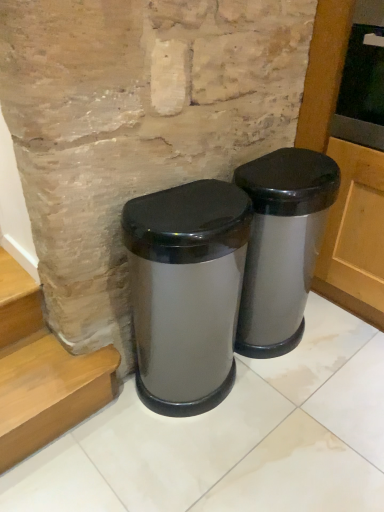
Find the location of a particular element. satin silver trash can at center, the 1th waste container positioned from the right is located at coordinates (282, 245).

What is the approximate height of satin silver trash can at center, the 1th waste container positioned from the right?

27.30 inches.

This screenshot has height=512, width=384. What do you see at coordinates (282, 245) in the screenshot?
I see `satin silver trash can at center, the 1th waste container positioned from the right` at bounding box center [282, 245].

The image size is (384, 512). In order to click on satin silver trash can at center, which is the 1th waste container in left-to-right order in this screenshot , I will do `click(186, 292)`.

Measure the distance between satin silver trash can at center, arranged as the second waste container when viewed from the right, and camera.

They are 38.10 inches apart.

What do you see at coordinates (186, 292) in the screenshot? I see `satin silver trash can at center, arranged as the second waste container when viewed from the right` at bounding box center [186, 292].

Locate an element on the screen. satin silver trash can at center, the 1th waste container positioned from the right is located at coordinates (282, 245).

Based on the photo, in the image, is satin silver trash can at center, which is the 1th waste container in left-to-right order, on the left side or the right side of satin silver trash can at center, the 1th waste container positioned from the right?

Clearly, satin silver trash can at center, which is the 1th waste container in left-to-right order, is on the left of satin silver trash can at center, the 1th waste container positioned from the right, in the image.

Based on the photo, is satin silver trash can at center, which is the 1th waste container in left-to-right order, further to camera compared to satin silver trash can at center, the 1th waste container positioned from the right?

No, satin silver trash can at center, which is the 1th waste container in left-to-right order, is closer to the viewer.

Considering the points (201, 395) and (280, 241), which point is behind, point (201, 395) or point (280, 241)?

Positioned behind is point (201, 395).

From the image's perspective, is satin silver trash can at center, which is the 1th waste container in left-to-right order, on top of satin silver trash can at center, which is the 2th waste container in left-to-right order?

Actually, satin silver trash can at center, which is the 1th waste container in left-to-right order, appears below satin silver trash can at center, which is the 2th waste container in left-to-right order, in the image.

From a real-world perspective, who is located higher, satin silver trash can at center, which is the 1th waste container in left-to-right order, or satin silver trash can at center, the 1th waste container positioned from the right?

satin silver trash can at center, which is the 1th waste container in left-to-right order.

Looking at this image, which of these two, satin silver trash can at center, arranged as the second waste container when viewed from the right, or satin silver trash can at center, the 1th waste container positioned from the right, is wider?

satin silver trash can at center, arranged as the second waste container when viewed from the right, is wider.

Who is shorter, satin silver trash can at center, arranged as the second waste container when viewed from the right, or satin silver trash can at center, which is the 2th waste container in left-to-right order?

satin silver trash can at center, which is the 2th waste container in left-to-right order.

Is satin silver trash can at center, which is the 1th waste container in left-to-right order, bigger or smaller than satin silver trash can at center, the 1th waste container positioned from the right?

Considering their sizes, satin silver trash can at center, which is the 1th waste container in left-to-right order, takes up less space than satin silver trash can at center, the 1th waste container positioned from the right.

Do you think satin silver trash can at center, arranged as the second waste container when viewed from the right, is within satin silver trash can at center, the 1th waste container positioned from the right, or outside of it?

The correct answer is: outside.

Is satin silver trash can at center, which is the 1th waste container in left-to-right order, directly adjacent to satin silver trash can at center, which is the 2th waste container in left-to-right order?

No, satin silver trash can at center, which is the 1th waste container in left-to-right order, is not beside satin silver trash can at center, which is the 2th waste container in left-to-right order.

Looking at this image, is satin silver trash can at center, arranged as the second waste container when viewed from the right, positioned with its back to satin silver trash can at center, the 1th waste container positioned from the right?

That's not correct — satin silver trash can at center, arranged as the second waste container when viewed from the right, is not looking away from satin silver trash can at center, the 1th waste container positioned from the right.

Measure the distance from satin silver trash can at center, which is the 1th waste container in left-to-right order, to satin silver trash can at center, which is the 2th waste container in left-to-right order.

satin silver trash can at center, which is the 1th waste container in left-to-right order, and satin silver trash can at center, which is the 2th waste container in left-to-right order, are 9.18 inches apart from each other.

In order to click on waste container that is behind the satin silver trash can at center, arranged as the second waste container when viewed from the right in this screenshot , I will do `click(282, 245)`.

Which object is positioned more to the right, satin silver trash can at center, the 1th waste container positioned from the right, or satin silver trash can at center, arranged as the second waste container when viewed from the right?

satin silver trash can at center, the 1th waste container positioned from the right.

Relative to satin silver trash can at center, arranged as the second waste container when viewed from the right, is satin silver trash can at center, which is the 2th waste container in left-to-right order, in front or behind?

In the image, satin silver trash can at center, which is the 2th waste container in left-to-right order, appears behind satin silver trash can at center, arranged as the second waste container when viewed from the right.

Considering the positions of point (253, 179) and point (151, 402), is point (253, 179) closer or farther from the camera than point (151, 402)?

Clearly, point (253, 179) is closer to the camera than point (151, 402).

Looking at this image, from the image's perspective, between satin silver trash can at center, the 1th waste container positioned from the right, and satin silver trash can at center, which is the 1th waste container in left-to-right order, which one is located above?

satin silver trash can at center, the 1th waste container positioned from the right.

From a real-world perspective, which is physically below, satin silver trash can at center, the 1th waste container positioned from the right, or satin silver trash can at center, arranged as the second waste container when viewed from the right?

satin silver trash can at center, the 1th waste container positioned from the right.

Which object is wider, satin silver trash can at center, the 1th waste container positioned from the right, or satin silver trash can at center, which is the 1th waste container in left-to-right order?

Wider between the two is satin silver trash can at center, which is the 1th waste container in left-to-right order.

Considering the sizes of objects satin silver trash can at center, which is the 2th waste container in left-to-right order, and satin silver trash can at center, arranged as the second waste container when viewed from the right, in the image provided, who is taller, satin silver trash can at center, which is the 2th waste container in left-to-right order, or satin silver trash can at center, arranged as the second waste container when viewed from the right,?

Standing taller between the two is satin silver trash can at center, arranged as the second waste container when viewed from the right.

Considering the relative sizes of satin silver trash can at center, the 1th waste container positioned from the right, and satin silver trash can at center, arranged as the second waste container when viewed from the right, in the image provided, is satin silver trash can at center, the 1th waste container positioned from the right, bigger than satin silver trash can at center, arranged as the second waste container when viewed from the right,?

Yes, satin silver trash can at center, the 1th waste container positioned from the right, is bigger than satin silver trash can at center, arranged as the second waste container when viewed from the right.

Does satin silver trash can at center, the 1th waste container positioned from the right, contain satin silver trash can at center, which is the 1th waste container in left-to-right order?

No.

Are satin silver trash can at center, the 1th waste container positioned from the right, and satin silver trash can at center, arranged as the second waste container when viewed from the right, located far from each other?

No, satin silver trash can at center, the 1th waste container positioned from the right, is in close proximity to satin silver trash can at center, arranged as the second waste container when viewed from the right.

Is satin silver trash can at center, the 1th waste container positioned from the right, positioned with its back to satin silver trash can at center, arranged as the second waste container when viewed from the right?

No, satin silver trash can at center, arranged as the second waste container when viewed from the right, is not at the back of satin silver trash can at center, the 1th waste container positioned from the right.

This screenshot has height=512, width=384. Find the location of `waste container above the satin silver trash can at center, which is the 2th waste container in left-to-right order (from a real-world perspective)`. waste container above the satin silver trash can at center, which is the 2th waste container in left-to-right order (from a real-world perspective) is located at coordinates (186, 292).

The width and height of the screenshot is (384, 512). I want to click on waste container behind the satin silver trash can at center, which is the 1th waste container in left-to-right order, so click(x=282, y=245).

The width and height of the screenshot is (384, 512). I want to click on waste container above the satin silver trash can at center, arranged as the second waste container when viewed from the right (from the image's perspective), so click(282, 245).